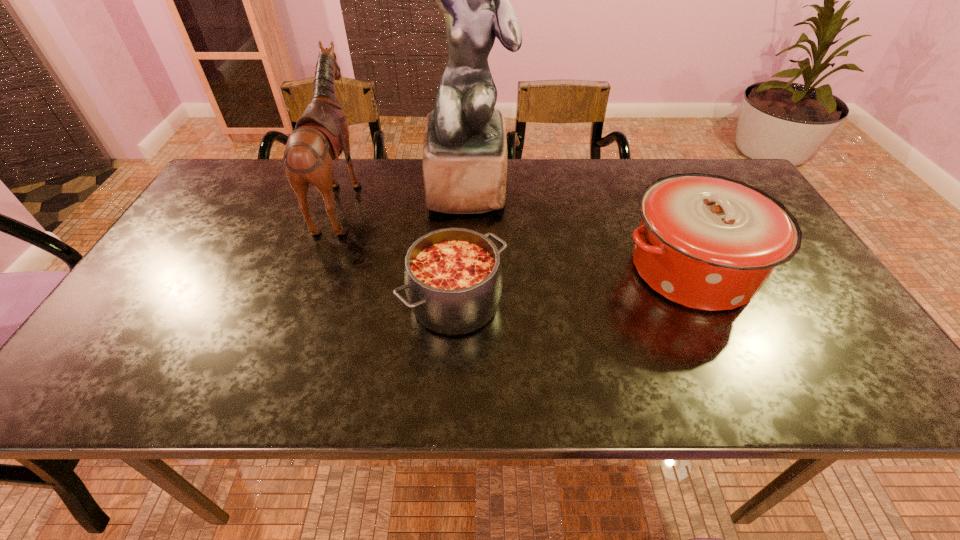
Identify the location of sculpture. Image resolution: width=960 pixels, height=540 pixels. (464, 162).

Locate an element on the screen. This screenshot has width=960, height=540. saddle is located at coordinates (321, 134).

I want to click on the leftmost object, so click(321, 134).

This screenshot has width=960, height=540. I want to click on the third tallest object, so click(x=707, y=242).

This screenshot has width=960, height=540. What are the coordinates of `the rightmost object` in the screenshot? It's located at (707, 242).

I want to click on the shortest object, so click(x=453, y=282).

Where is `the shorter casserole`? the shorter casserole is located at coordinates (453, 282).

Find the location of a particular element. This screenshot has height=540, width=960. vacant space located 0.070m in a relaxed pose on the sculpture is located at coordinates (468, 234).

Find the location of `free location located 0.300m on the back of the saddle`. free location located 0.300m on the back of the saddle is located at coordinates (466, 197).

Find the location of `free space located on the back of the rightmost object`. free space located on the back of the rightmost object is located at coordinates (654, 190).